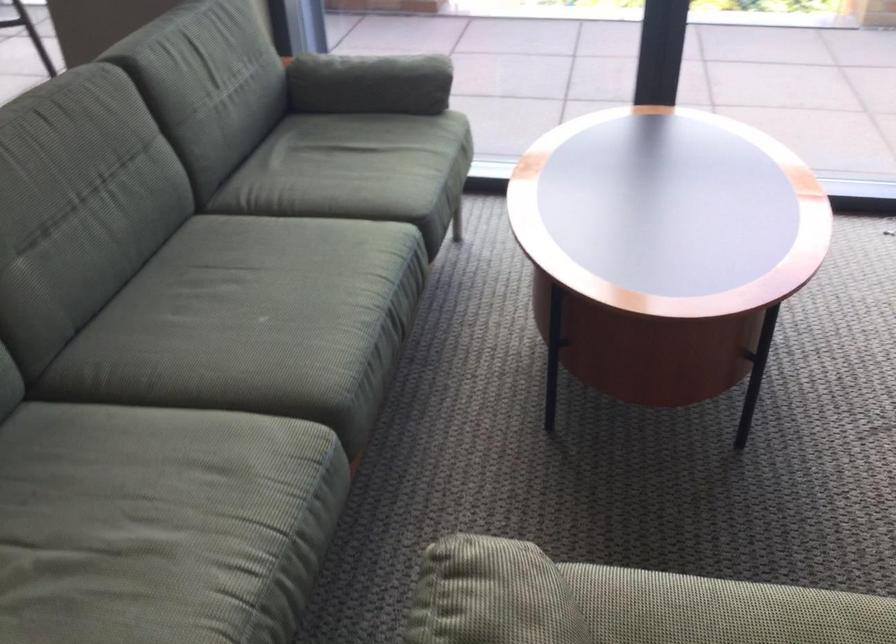
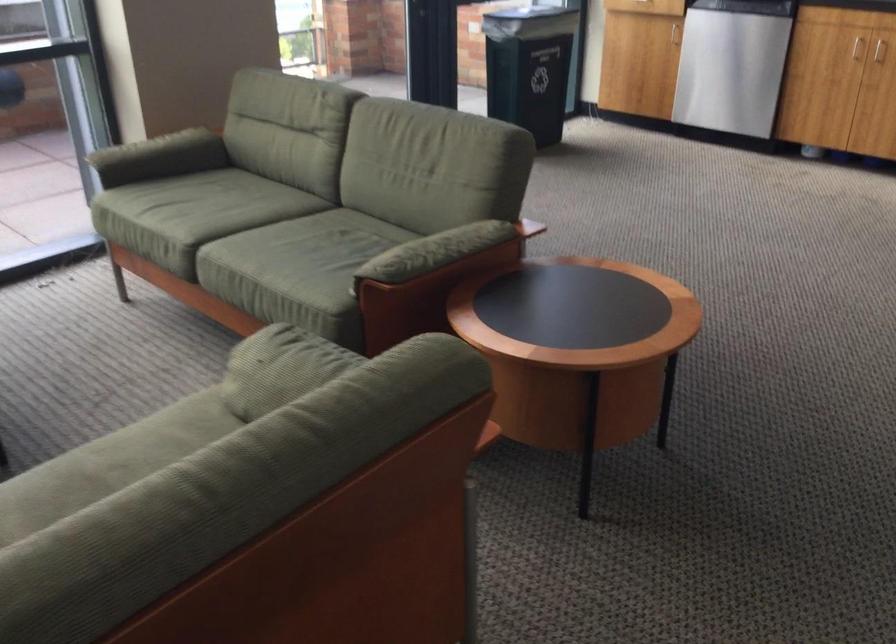
Question: The camera is either moving clockwise (left) or counter-clockwise (right) around the object. The first image is from the beginning of the video and the second image is from the end. Is the camera moving left or right when shooting the video?

Choices:
 (A) Left
 (B) Right

Answer: (A)